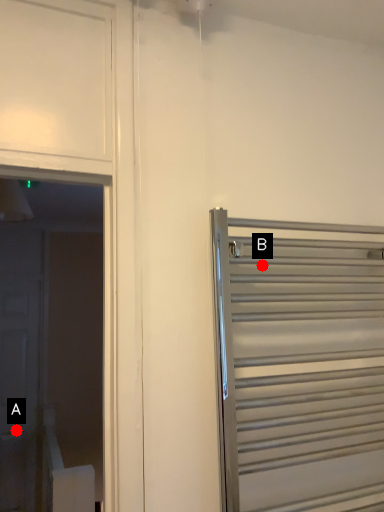
Question: Two points are circled on the image, labeled by A and B beside each circle. Which point appears closest to the camera in this image?

Choices:
 (A) A is closer
 (B) B is closer

Answer: (B)